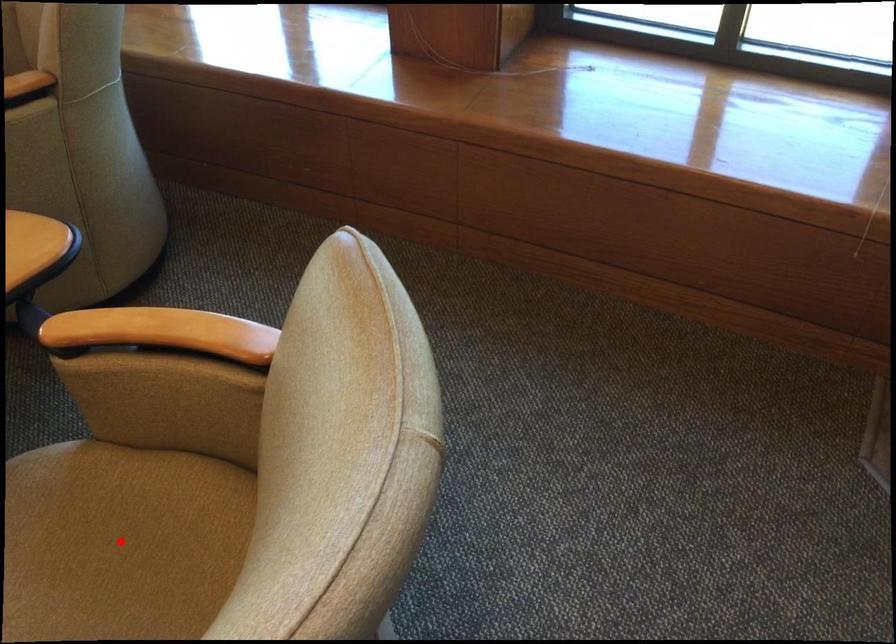
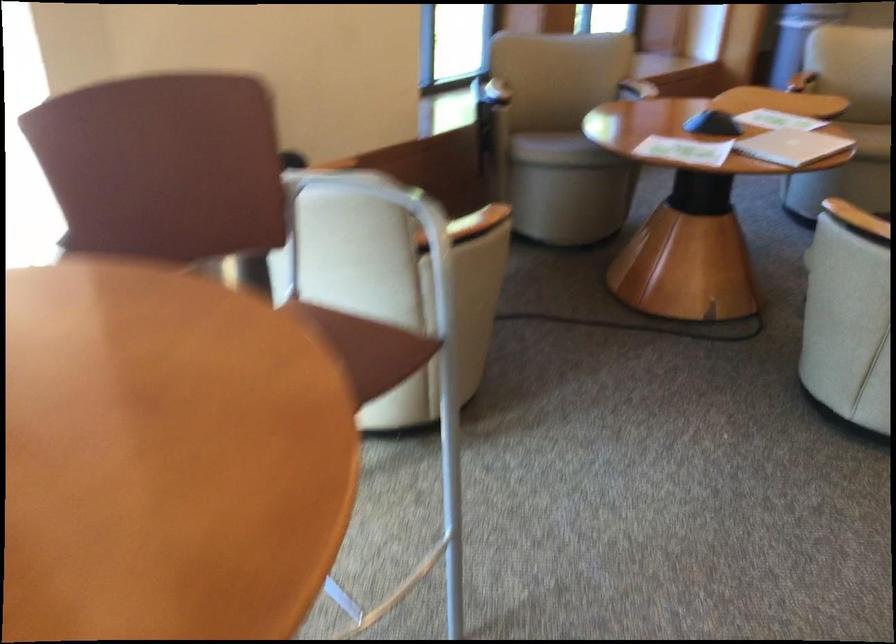
Question: I am providing you with two images of the same scene from different viewpoints. A red point is marked on the first image. Can you still see the location of the red point in image 2?

Choices:
 (A) Yes
 (B) No

Answer: (B)